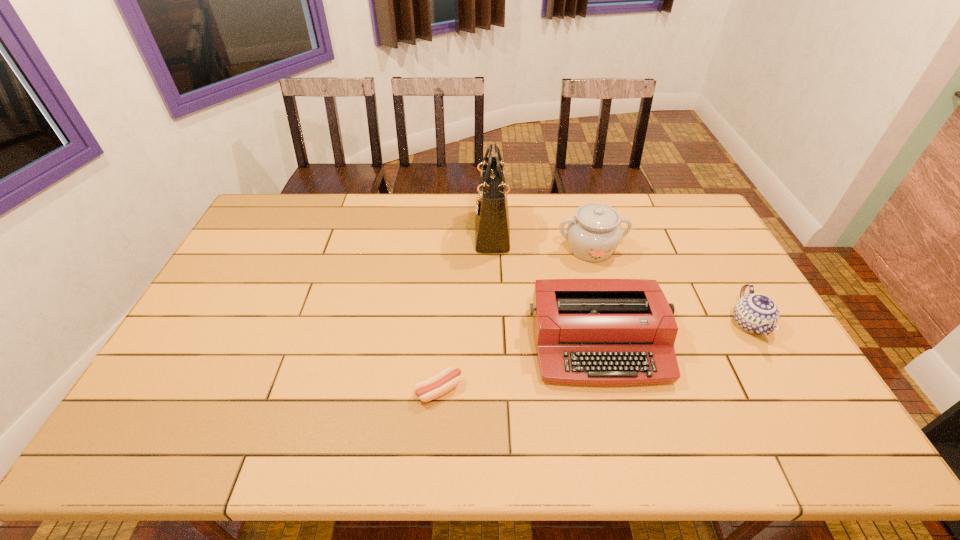
In order to click on vacant space that satisfies the following two spatial constraints: 1. at the front of the farther chinaware with visible charms; 2. on the left side of the handbag in this screenshot , I will do `click(492, 249)`.

This screenshot has width=960, height=540. In order to click on blank area in the image that satisfies the following two spatial constraints: 1. at the front of the taller chinaware with visible charms; 2. on the right side of the tallest object in this screenshot , I will do `click(492, 249)`.

The height and width of the screenshot is (540, 960). In order to click on free point that satisfies the following two spatial constraints: 1. at the front of the tallest object with visible charms; 2. on the back side of the left chinaware in this screenshot , I will do `click(492, 249)`.

Find the location of a particular element. The height and width of the screenshot is (540, 960). free point that satisfies the following two spatial constraints: 1. on the back side of the farther chinaware; 2. at the front of the second object from left to right with visible charms is located at coordinates (586, 231).

I want to click on vacant region that satisfies the following two spatial constraints: 1. on the back side of the leftmost object; 2. on the left side of the fourth shortest object, so click(449, 249).